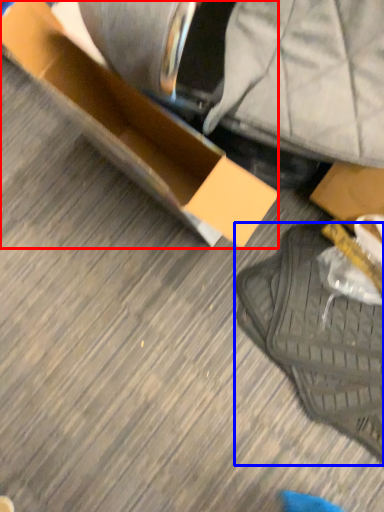
Question: Which object appears closest to the camera in this image, box (highlighted by a red box) or footwear (highlighted by a blue box)?

Choices:
 (A) box
 (B) footwear

Answer: (A)